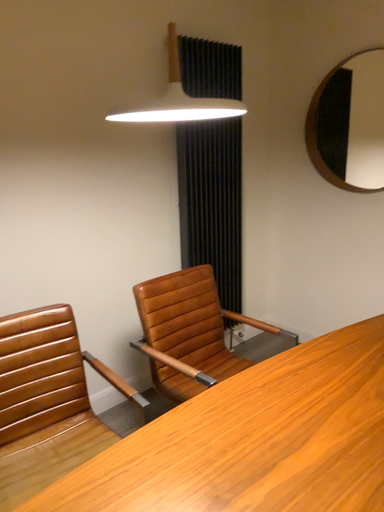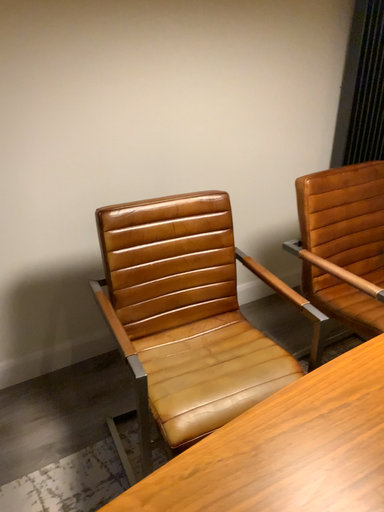
Question: How did the camera likely rotate when shooting the video?

Choices:
 (A) rotated left
 (B) rotated right

Answer: (A)